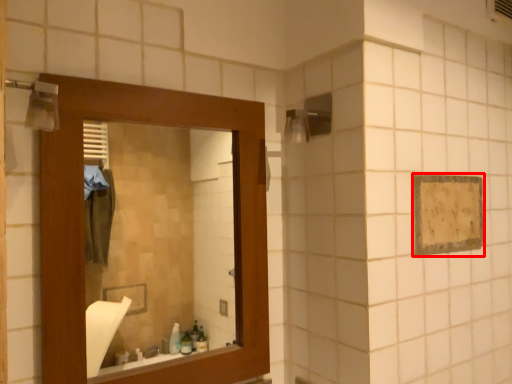
Question: From the image's perspective, where is square (annotated by the red box) located relative to mirror?

Choices:
 (A) above
 (B) below

Answer: (A)